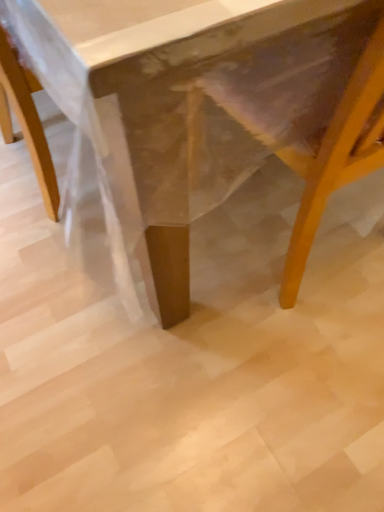
Question: In terms of size, does wooden swivel chair at lower right appear bigger or smaller than wooden table at center?

Choices:
 (A) small
 (B) big

Answer: (A)

Question: In terms of height, does wooden swivel chair at lower right look taller or shorter compared to wooden table at center?

Choices:
 (A) short
 (B) tall

Answer: (A)

Question: Do you think wooden swivel chair at lower right is within wooden table at center, or outside of it?

Choices:
 (A) inside
 (B) outside

Answer: (A)

Question: In terms of height, does wooden table at center look taller or shorter compared to wooden swivel chair at lower right?

Choices:
 (A) short
 (B) tall

Answer: (B)

Question: Visually, is wooden table at center positioned to the left or to the right of wooden swivel chair at lower right?

Choices:
 (A) right
 (B) left

Answer: (B)

Question: Is wooden table at center in front of or behind wooden swivel chair at lower right in the image?

Choices:
 (A) behind
 (B) front

Answer: (B)

Question: From the image's perspective, relative to wooden swivel chair at lower right, is wooden table at center above or below?

Choices:
 (A) above
 (B) below

Answer: (A)